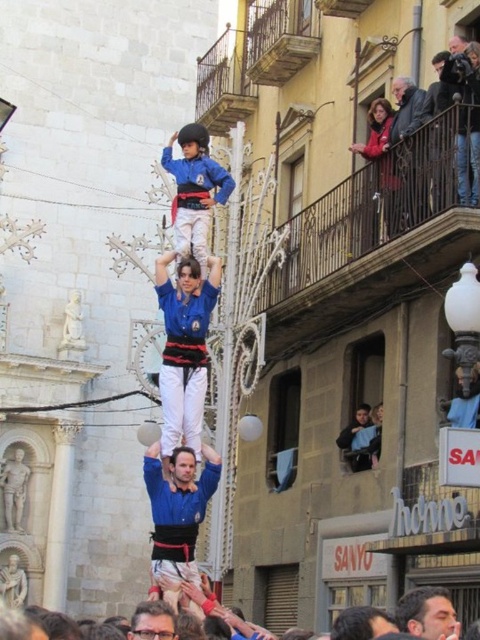
Question: Among these points, which one is nearest to the camera?

Choices:
 (A) (158, 614)
 (B) (173, 164)
 (C) (435, 604)
 (D) (420, 621)

Answer: (D)

Question: Which point appears closest to the camera in this image?

Choices:
 (A) (180, 298)
 (B) (160, 609)

Answer: (B)

Question: Can you confirm if blue fabric man at center is positioned to the right of smooth brown hair at center?

Choices:
 (A) yes
 (B) no

Answer: (B)

Question: Which object is closer to the camera taking this photo?

Choices:
 (A) smooth brown hair at center
 (B) white cotton crowd at lower center
 (C) matte blue uniform at center
 (D) blue fabric man at center

Answer: (B)

Question: Does matte blue uniform at center appear on the right side of smooth brown hair at center?

Choices:
 (A) no
 (B) yes

Answer: (A)

Question: Can you confirm if smooth brown hair at center is thinner than blue fabric shirt at center?

Choices:
 (A) yes
 (B) no

Answer: (B)